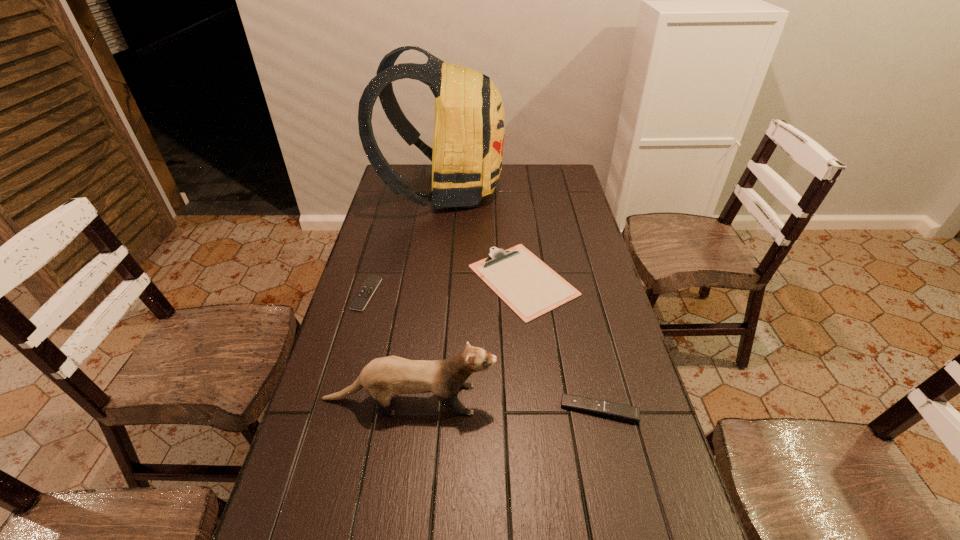
At what (x,y) coordinates should I click in order to perform the action: click on free space located on the back of the clipboard. Please return your answer as a coordinate pair (x, y). Image resolution: width=960 pixels, height=540 pixels. Looking at the image, I should click on (515, 205).

Where is `free space located on the back of the right remote control`? This screenshot has height=540, width=960. free space located on the back of the right remote control is located at coordinates tap(584, 341).

I want to click on free space located on the front of the shorter remote control, so [344, 374].

Where is `object situated at the far edge`? The image size is (960, 540). object situated at the far edge is located at coordinates [469, 126].

I want to click on backpack present at the left edge, so click(469, 126).

Locate an element on the screen. The image size is (960, 540). ferret at the left edge is located at coordinates click(x=383, y=378).

Image resolution: width=960 pixels, height=540 pixels. Find the location of `remote control located at the left edge`. remote control located at the left edge is located at coordinates (361, 299).

Identify the location of clipboard that is positioned at the right edge. This screenshot has width=960, height=540. (526, 284).

You are a GUI agent. You are given a task and a screenshot of the screen. Output one action in this format:
    pyautogui.click(x=<x>, y=<y>)
    Task: Click on the remote control that is at the right edge
    
    Given the screenshot: What is the action you would take?
    pyautogui.click(x=618, y=411)

This screenshot has width=960, height=540. Identify the location of object present at the far left corner. [x=469, y=126].